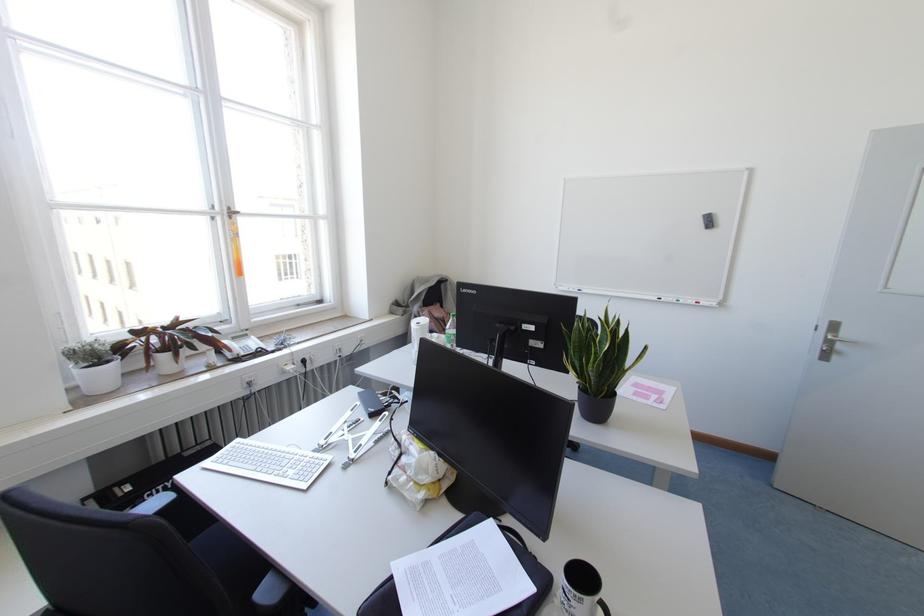
The location [568,288] corresponds to which object?

It corresponds to the blue whiteboard marker in the image.